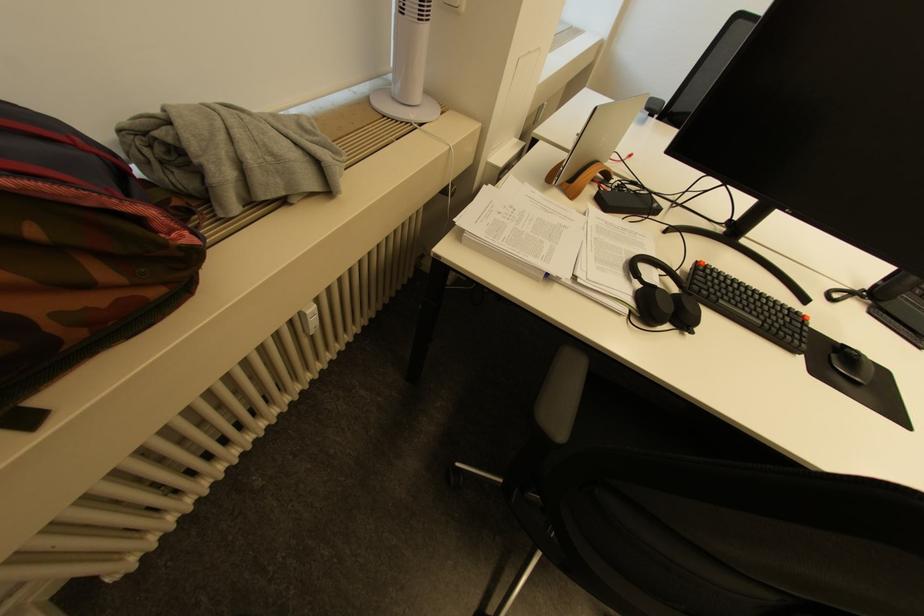
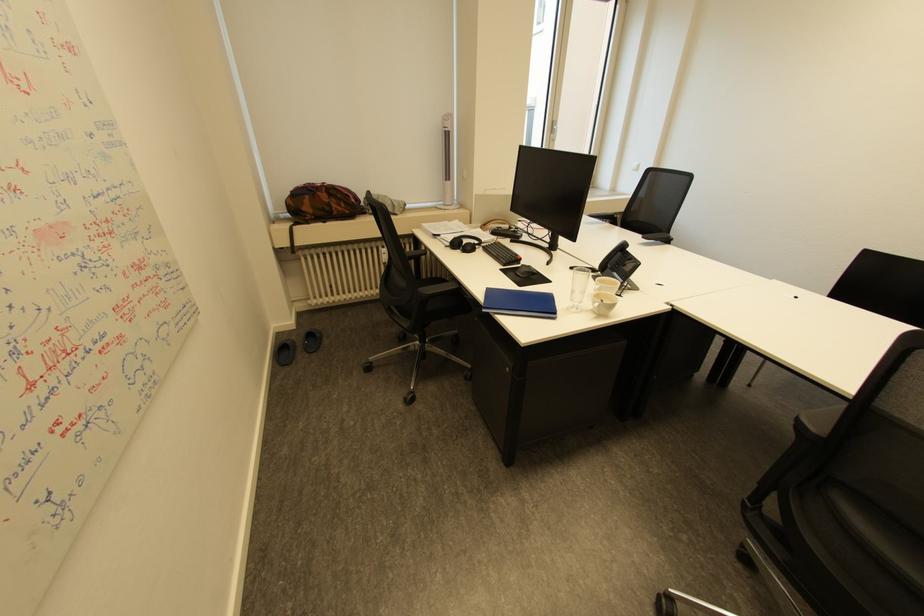
In the second image, find the point that corresponds to the point at 845,379 in the first image.

(518, 274)